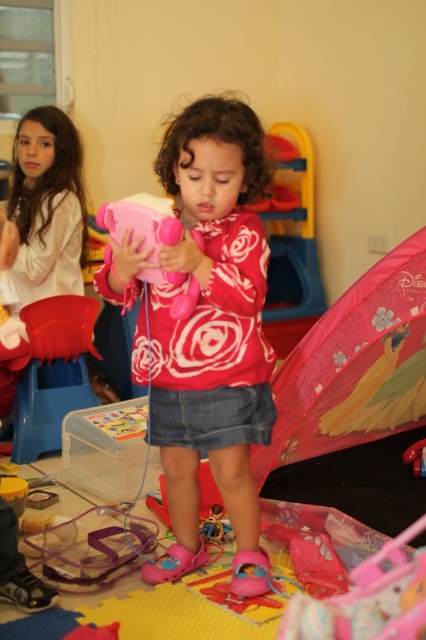
Locate an element on the screen. The width and height of the screenshot is (426, 640). rubberized pink sandals at lower center is located at coordinates (92, 547).

Is rubberized pink sandals at lower center below matte pink toy at center?

Indeed, rubberized pink sandals at lower center is positioned under matte pink toy at center.

Does point (112, 541) come closer to viewer compared to point (118, 241)?

No, it is not.

This screenshot has width=426, height=640. I want to click on rubberized pink sandals at lower center, so click(92, 547).

Can you confirm if pink matte toy phone at center is bigger than matte pink toy at center?

Indeed, pink matte toy phone at center has a larger size compared to matte pink toy at center.

Find the location of a particular element. pink matte toy phone at center is located at coordinates (213, 336).

Find the location of a particular element. This screenshot has width=426, height=640. pink matte toy phone at center is located at coordinates (213, 336).

Is pink matte toy phone at center to the left of rubberized pink sandals at lower center from the viewer's perspective?

In fact, pink matte toy phone at center is to the right of rubberized pink sandals at lower center.

The height and width of the screenshot is (640, 426). What do you see at coordinates (213, 336) in the screenshot?
I see `pink matte toy phone at center` at bounding box center [213, 336].

Where is `pink matte toy phone at center`? pink matte toy phone at center is located at coordinates (213, 336).